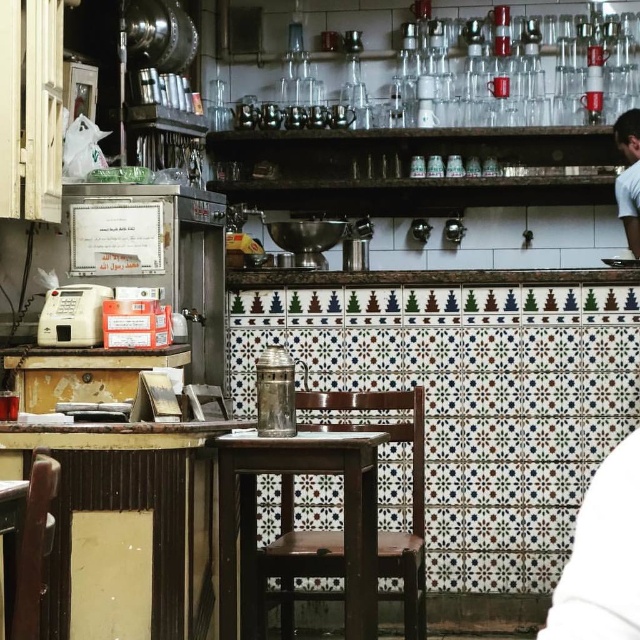
You are sitting at the wooden table with dark finish in the foreground of the traditional cafe. You notice two points marked on the tiled wall in the background. The first point is at coordinates point (250, 486) and the second is at point (636, 618). Which of these points is closer to you?

Point (636, 618) is closer to you because it is in front of point (250, 486).

You are a customer entering the cafe and want to sit down. You see the wooden bar stool at center and the white fabric shirt at upper right. Which object is closer to the entrance?

The wooden bar stool at center is closer to the entrance because it is to the left of the white fabric shirt at upper right, implying it is positioned nearer to where you are standing.

You are a customer in the cafe and want to sit down. There is a wooden bar stool at center and a white fabric at lower right. Which one can you sit on?

The wooden bar stool at center is larger than the white fabric at lower right, so you can sit on the wooden bar stool at center.